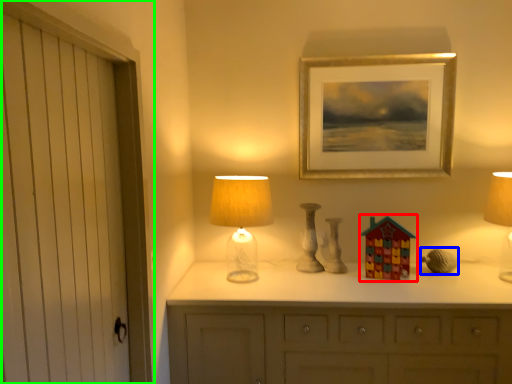
Question: Which is nearer to the toy (highlighted by a red box)? miniature (highlighted by a blue box) or door (highlighted by a green box).

Choices:
 (A) miniature
 (B) door

Answer: (A)